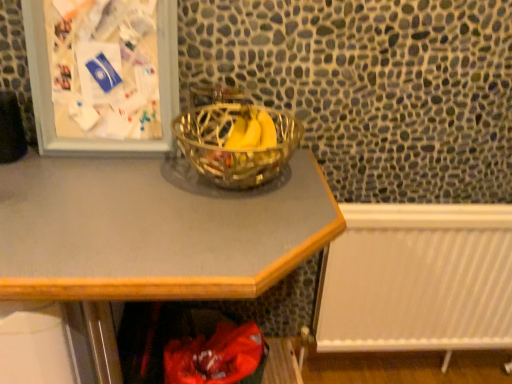
What is the approximate height of clear glass bowl at center?

6.67 inches.

Describe the element at coordinates (234, 150) in the screenshot. The width and height of the screenshot is (512, 384). I see `clear glass bowl at center` at that location.

Image resolution: width=512 pixels, height=384 pixels. I want to click on metallic gray desk at center, so click(x=151, y=235).

Between metallic gray desk at center and white plastic radiator at lower right, which one is positioned in front?

metallic gray desk at center is more forward.

Is metallic gray desk at center next to white plastic radiator at lower right?

There is a gap between metallic gray desk at center and white plastic radiator at lower right.

Does point (214, 249) lie in front of point (445, 319)?

That is True.

Considering the relative sizes of metallic gray desk at center and white plastic radiator at lower right in the image provided, is metallic gray desk at center shorter than white plastic radiator at lower right?

Incorrect, the height of metallic gray desk at center does not fall short of that of white plastic radiator at lower right.

Considering the sizes of objects metallic silver picture frame at upper left and clear glass bowl at center in the image provided, who is smaller, metallic silver picture frame at upper left or clear glass bowl at center?

Smaller between the two is clear glass bowl at center.

From a real-world perspective, is metallic silver picture frame at upper left positioned under clear glass bowl at center based on gravity?

Incorrect, from a real-world perspective, metallic silver picture frame at upper left is higher than clear glass bowl at center.

Which point is more distant from viewer, (34, 101) or (232, 175)?

The point (34, 101) is farther from the camera.

From the image's perspective, is metallic silver picture frame at upper left over clear glass bowl at center?

Yes, from the image's perspective, metallic silver picture frame at upper left is over clear glass bowl at center.

From a real-world perspective, who is located higher, clear glass bowl at center or metallic gray desk at center?

From a 3D spatial view, clear glass bowl at center is above.

Is clear glass bowl at center to the left of metallic gray desk at center from the viewer's perspective?

In fact, clear glass bowl at center is to the right of metallic gray desk at center.

Is clear glass bowl at center shorter than metallic gray desk at center?

Yes.

Is clear glass bowl at center inside or outside of metallic gray desk at center?

clear glass bowl at center is not enclosed by metallic gray desk at center.

From the image's perspective, is white plastic radiator at lower right located beneath metallic silver picture frame at upper left?

Correct, white plastic radiator at lower right appears lower than metallic silver picture frame at upper left in the image.

Is white plastic radiator at lower right behind metallic silver picture frame at upper left?

Yes, the depth of white plastic radiator at lower right is greater than that of metallic silver picture frame at upper left.

Where is `picture frame on the left of white plastic radiator at lower right`? The height and width of the screenshot is (384, 512). picture frame on the left of white plastic radiator at lower right is located at coordinates (50, 90).

Looking at this image, how far apart are white plastic radiator at lower right and metallic silver picture frame at upper left?

white plastic radiator at lower right and metallic silver picture frame at upper left are 36.30 inches apart.

Does point (164, 97) come behind point (40, 248)?

Yes, it is.

From a real-world perspective, who is located lower, metallic silver picture frame at upper left or metallic gray desk at center?

metallic gray desk at center is physically lower.

Between metallic gray desk at center and metallic silver picture frame at upper left, which one has smaller width?

metallic silver picture frame at upper left.

Can you tell me how much metallic gray desk at center and metallic silver picture frame at upper left differ in facing direction?

metallic gray desk at center and metallic silver picture frame at upper left are facing 0.227 degrees away from each other.

In the scene shown: Is metallic gray desk at center facing away from metallic silver picture frame at upper left?

No.

From a real-world perspective, which object stands above the other?

metallic silver picture frame at upper left.

From a real-world perspective, who is located higher, metallic gray desk at center or clear glass bowl at center?

From a 3D spatial view, clear glass bowl at center is above.

Which object is closer to the camera, metallic gray desk at center or clear glass bowl at center?

Positioned in front is metallic gray desk at center.

Find the location of a particular element. desk on the left side of clear glass bowl at center is located at coordinates (151, 235).

Based on the photo, is metallic gray desk at center at the left side of clear glass bowl at center?

Indeed, metallic gray desk at center is positioned on the left side of clear glass bowl at center.

Find the location of a particular element. The image size is (512, 384). desk that is below the white plastic radiator at lower right (from the image's perspective) is located at coordinates (151, 235).

The height and width of the screenshot is (384, 512). In order to click on glass bowl that is under the metallic silver picture frame at upper left (from a real-world perspective) in this screenshot , I will do `click(234, 150)`.

When comparing their distances from metallic silver picture frame at upper left, does metallic gray desk at center or white plastic radiator at lower right seem closer?

Among the two, metallic gray desk at center is located nearer to metallic silver picture frame at upper left.

Estimate the real-world distances between objects in this image. Which object is further from metallic gray desk at center, clear glass bowl at center or metallic silver picture frame at upper left?

metallic silver picture frame at upper left is further to metallic gray desk at center.

Considering their positions, is metallic gray desk at center positioned further to clear glass bowl at center than metallic silver picture frame at upper left?

Among the two, metallic silver picture frame at upper left is located further to clear glass bowl at center.

Based on their spatial positions, is white plastic radiator at lower right or clear glass bowl at center further from metallic silver picture frame at upper left?

white plastic radiator at lower right lies further to metallic silver picture frame at upper left than the other object.

From the image, which object appears to be farther from white plastic radiator at lower right, metallic gray desk at center or clear glass bowl at center?

metallic gray desk at center is further to white plastic radiator at lower right.

When comparing their distances from metallic silver picture frame at upper left, does clear glass bowl at center or white plastic radiator at lower right seem further?

Among the two, white plastic radiator at lower right is located further to metallic silver picture frame at upper left.

Based on their spatial positions, is clear glass bowl at center or metallic gray desk at center closer to white plastic radiator at lower right?

clear glass bowl at center.

Which object lies further to the anchor point clear glass bowl at center, white plastic radiator at lower right or metallic silver picture frame at upper left?

white plastic radiator at lower right.

I want to click on glass bowl between metallic silver picture frame at upper left and white plastic radiator at lower right, so click(x=234, y=150).

Image resolution: width=512 pixels, height=384 pixels. In order to click on glass bowl between metallic gray desk at center and white plastic radiator at lower right in the horizontal direction in this screenshot , I will do `click(234, 150)`.

Find the location of a particular element. The image size is (512, 384). glass bowl between metallic silver picture frame at upper left and metallic gray desk at center in the up-down direction is located at coordinates (234, 150).

The image size is (512, 384). I want to click on desk located between metallic silver picture frame at upper left and white plastic radiator at lower right in the left-right direction, so click(151, 235).